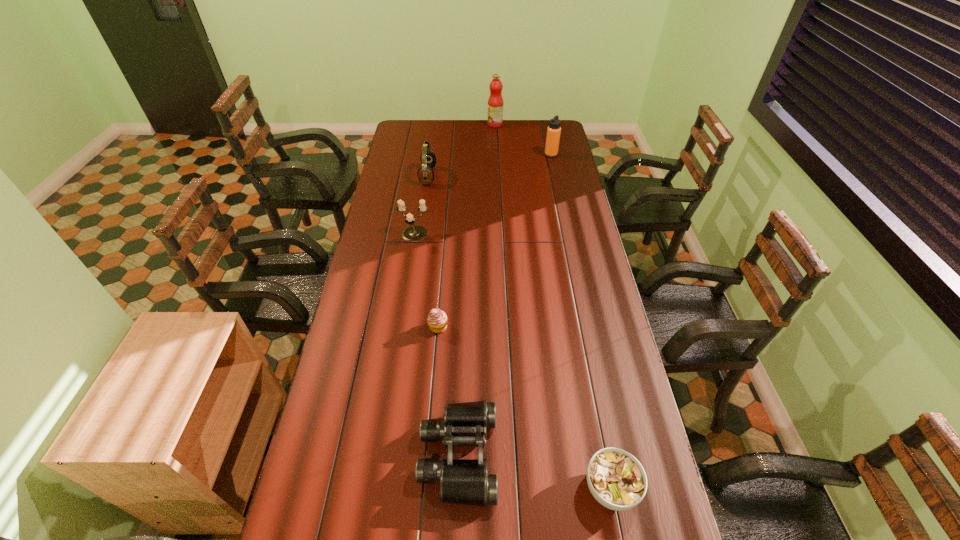
The width and height of the screenshot is (960, 540). Identify the location of vacant point located between the binoculars and the farthest object. (477, 290).

I want to click on vacant area that lies between the second tallest object and the binoculars, so click(505, 305).

Identify the location of unoccupied area between the second tallest object and the third farthest object. (490, 165).

The width and height of the screenshot is (960, 540). What are the coordinates of `vacant space in between the third nearest object and the soup bowl` in the screenshot? It's located at (524, 407).

This screenshot has width=960, height=540. In order to click on empty location between the third shortest object and the soup bowl in this screenshot , I will do `click(535, 472)`.

You are a GUI agent. You are given a task and a screenshot of the screen. Output one action in this format:
    pyautogui.click(x=<x>, y=<y>)
    Task: Click on the vacant space in between the cupcake and the second farthest object
    This screenshot has width=960, height=540.
    Given the screenshot: What is the action you would take?
    pyautogui.click(x=494, y=241)

Locate an element on the screen. The height and width of the screenshot is (540, 960). object that is the fourth nearest to the fifth nearest object is located at coordinates (437, 320).

Choose which object is the third nearest neighbor to the cupcake. Please provide its 2D coordinates. Your answer should be formatted as a tuple, i.e. [(x, y)], where the tuple contains the x and y coordinates of a point satisfying the conditions above.

[(616, 479)]

Where is `free location that satisfies the following two spatial constraints: 1. on the ear cups of the fifth nearest object; 2. on the right side of the cupcake`? Image resolution: width=960 pixels, height=540 pixels. free location that satisfies the following two spatial constraints: 1. on the ear cups of the fifth nearest object; 2. on the right side of the cupcake is located at coordinates (406, 327).

In order to click on free spot that satisfies the following two spatial constraints: 1. on the front label of the soup bowl; 2. on the right side of the fruit juice in this screenshot , I will do `click(514, 488)`.